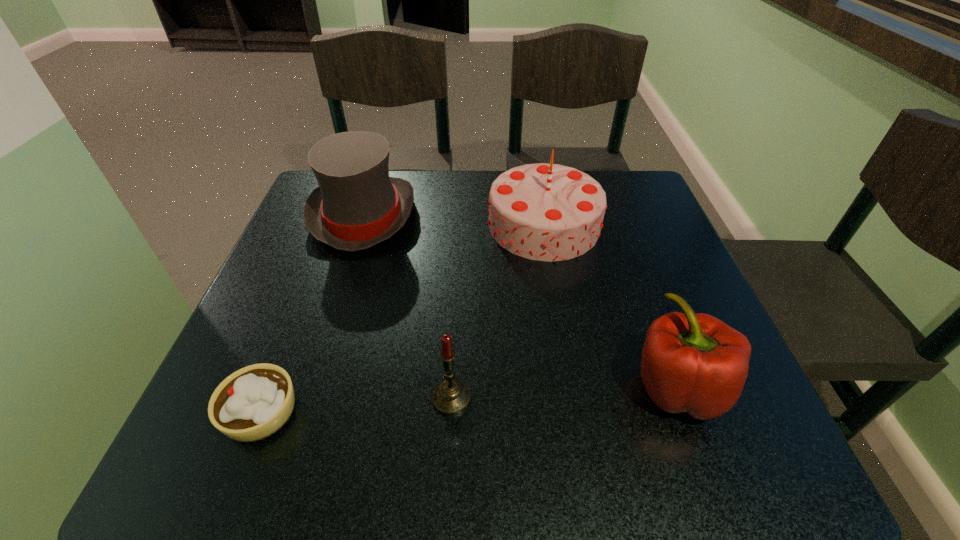
Find the location of `birthday cake`. birthday cake is located at coordinates (547, 212).

In order to click on dress hat in this screenshot , I will do `click(357, 205)`.

Where is `the third object from left to right`? This screenshot has width=960, height=540. the third object from left to right is located at coordinates (450, 397).

At what (x,y) coordinates should I click in order to perform the action: click on bell pepper. Please return your answer as a coordinate pair (x, y). This screenshot has height=540, width=960. Looking at the image, I should click on (695, 363).

Image resolution: width=960 pixels, height=540 pixels. I want to click on whipped cream, so click(254, 402).

Locate an element on the screen. blank space located 0.360m on the left of the birthday cake is located at coordinates (337, 225).

Find the location of a particular element. vacant space situated on the front of the dress hat is located at coordinates click(x=333, y=310).

You are a GUI agent. You are given a task and a screenshot of the screen. Output one action in this format:
    pyautogui.click(x=<x>, y=<y>)
    Task: Click on the vacant space located 0.360m on the back of the candle
    Image resolution: width=960 pixels, height=540 pixels.
    Given the screenshot: What is the action you would take?
    pos(459,245)

Find the location of a particular element. free space located 0.050m on the left of the bell pepper is located at coordinates (599, 387).

Find the location of a particular element. vacant region located on the back of the whipped cream is located at coordinates (292, 334).